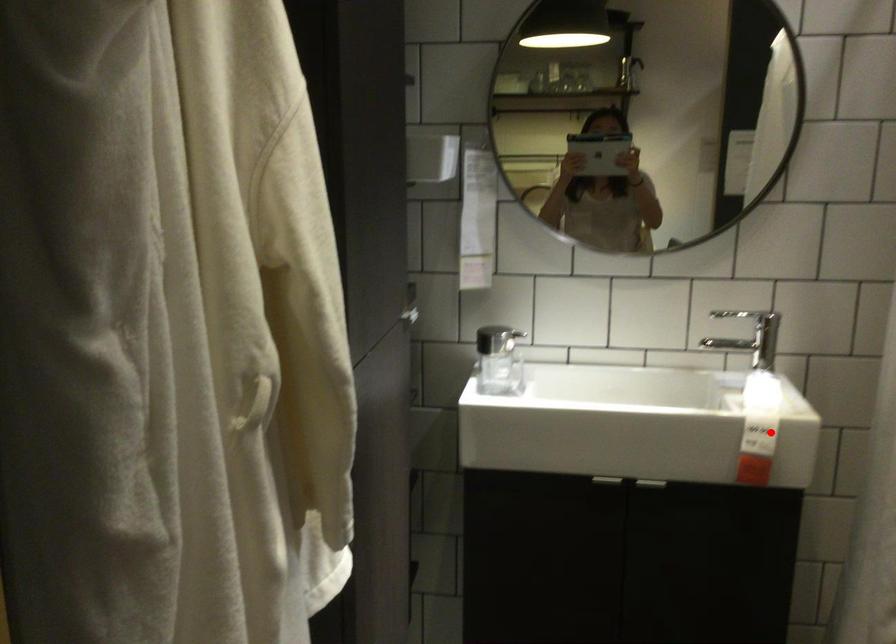
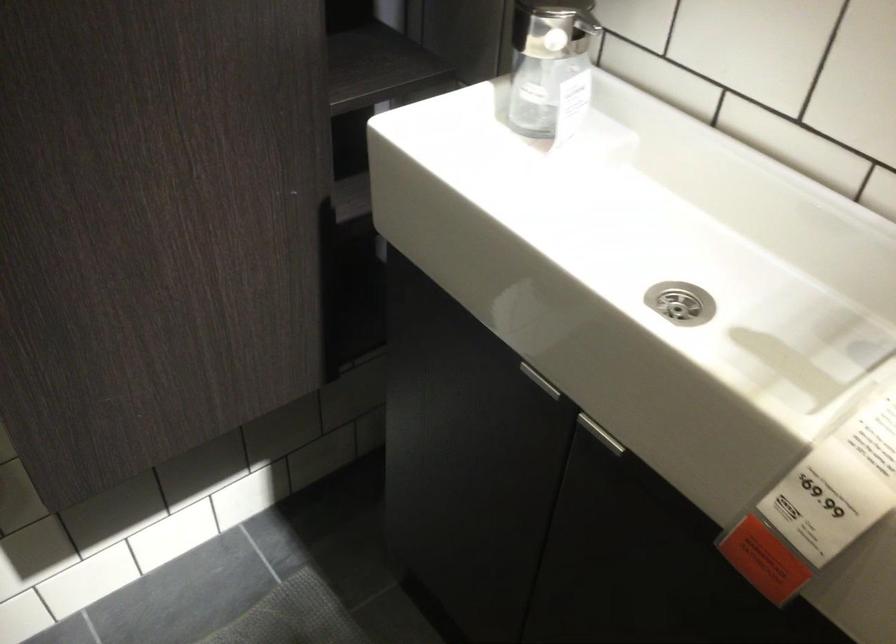
Question: A red point is marked in image1. In image2, is the corresponding 3D point closer to the camera or farther? Reply with the corresponding letter.

Choices:
 (A) The corresponding 3D point is closer.
 (B) The corresponding 3D point is farther.

Answer: (A)